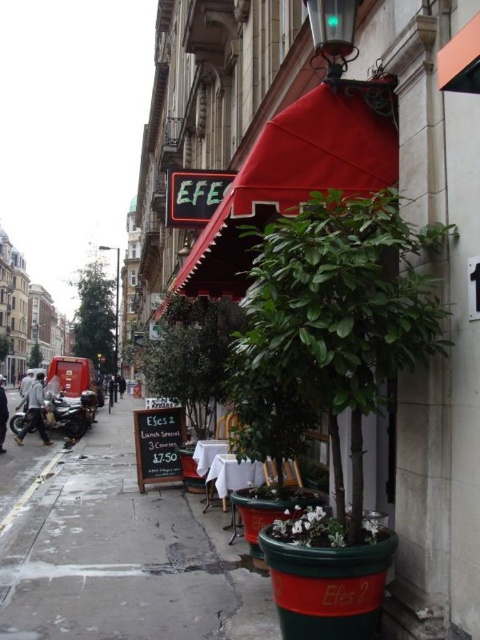
Is green leafy plant at center in front of dark gray jacket at center?

Yes, it is.

Find the location of `green leafy plant at center`. green leafy plant at center is located at coordinates 338,316.

Is shiny black motorcycle at left positioned behind dark blue jacket at left?

Yes, it is.

Who is lower down, shiny black motorcycle at left or dark blue jacket at left?

dark blue jacket at left

Is point (43, 412) in front of point (0, 449)?

No.

Where is `shiny black motorcycle at left`? The height and width of the screenshot is (640, 480). shiny black motorcycle at left is located at coordinates (70, 413).

Can you confirm if green leafy plant at center is positioned above green matte plant at center?

Yes.

Is point (350, 321) closer to viewer compared to point (330, 538)?

Yes, point (350, 321) is in front of point (330, 538).

What do you see at coordinates (338, 316) in the screenshot? The width and height of the screenshot is (480, 640). I see `green leafy plant at center` at bounding box center [338, 316].

Locate an element on the screen. This screenshot has height=640, width=480. green leafy plant at center is located at coordinates (338, 316).